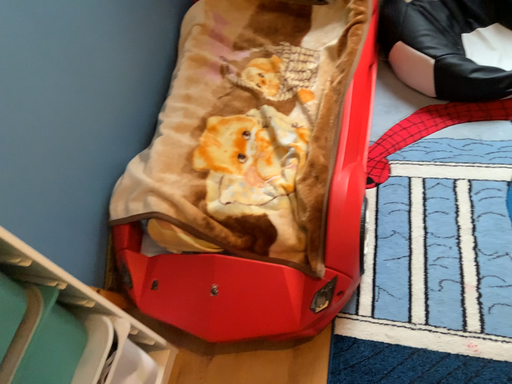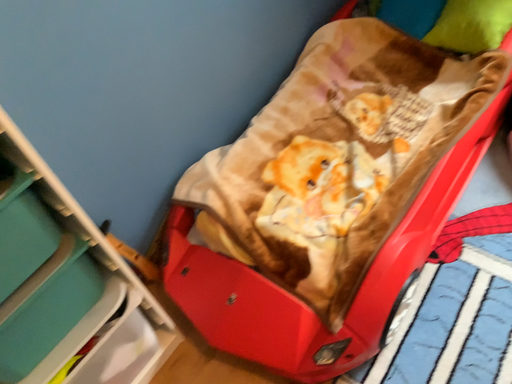
Question: How did the camera likely rotate when shooting the video?

Choices:
 (A) rotated right
 (B) rotated left

Answer: (B)